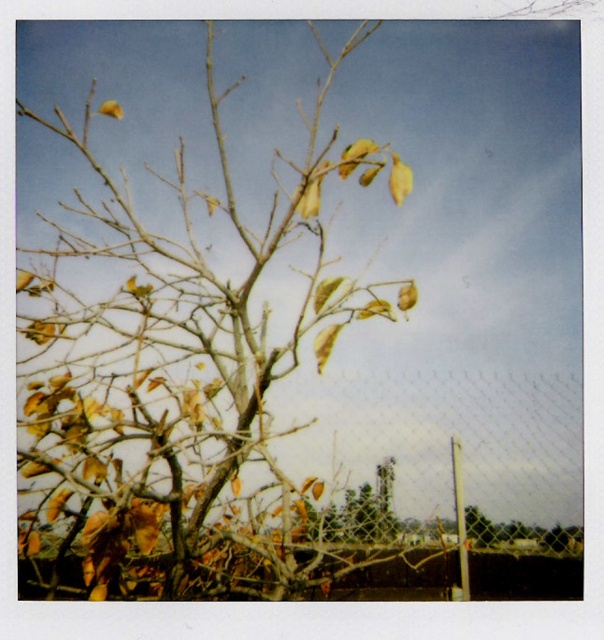
Question: Among these points, which one is farthest from the camera?

Choices:
 (A) (155, 561)
 (B) (349, 518)

Answer: (B)

Question: Does brown dry branch at center have a larger size compared to green matte tree at center?

Choices:
 (A) no
 (B) yes

Answer: (B)

Question: Which object is closer to the camera taking this photo?

Choices:
 (A) brown dry branch at center
 (B) green matte tree at center

Answer: (A)

Question: Can you confirm if brown dry branch at center is positioned above green matte tree at center?

Choices:
 (A) no
 (B) yes

Answer: (B)

Question: Can you confirm if brown dry branch at center is positioned to the left of green matte tree at center?

Choices:
 (A) no
 (B) yes

Answer: (B)